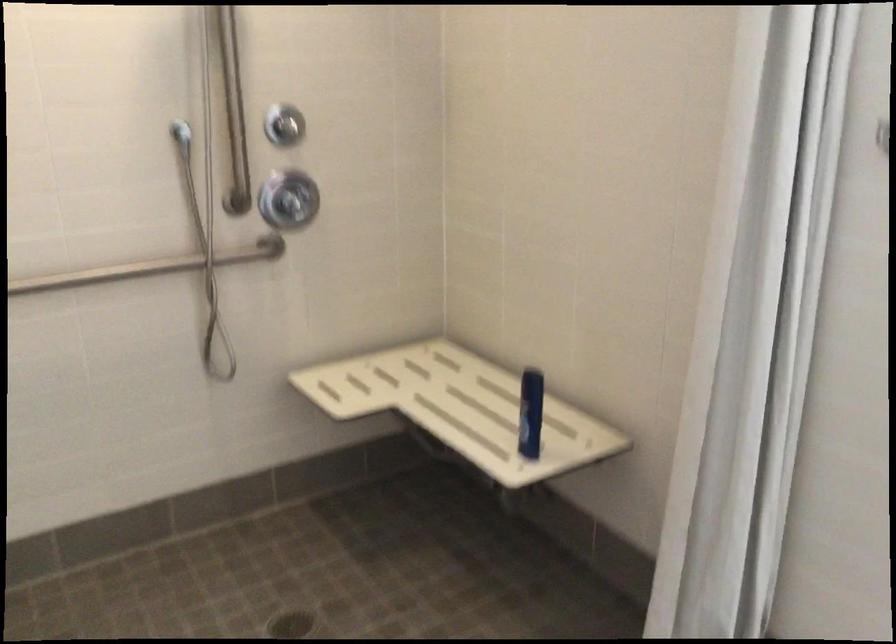
Where would you turn the chrome shower knob? Please return your answer as a coordinate pair (x, y).

(288, 200)